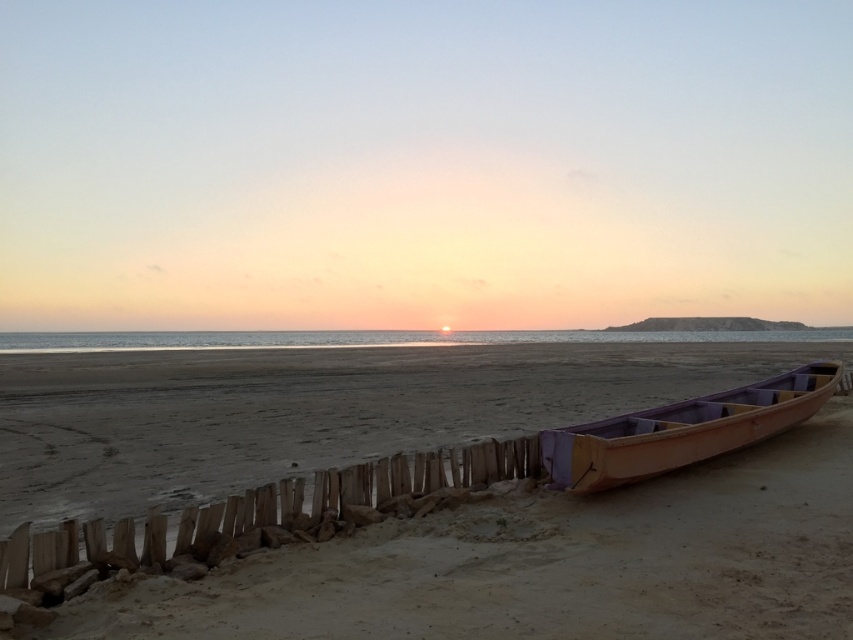
From the picture: You are a photographer trying to capture the sunset. You have two wooden objects in the scene, the wooden boat at lower right and the wooden canoe at right. Which one will block the view of the sunset if placed between you and the horizon?

The wooden canoe at right will block the view of the sunset since it has a greater height than the wooden boat at lower right, making it more likely to obstruct the horizon.

You are a lifeguard on duty at the beach and need to retrieve both the wooden boat at lower right and the wooden canoe at right for maintenance. If your reach extends 10 meters, can you grab both items without moving from your current position?

The wooden boat at lower right and wooden canoe at right are 9.65 meters apart. Since your reach extends 10 meters, you can grab both items without moving from your current position as the distance between them is within your reach.

You are standing on the beach looking at the wooden boat and the wooden fence structure. If you walk towards the wooden boat, will you first pass the point at coordinate point (549, 564) or point (608, 484)?

You will first pass the point at coordinate point (549, 564) because it is closer to the camera than point (608, 484).